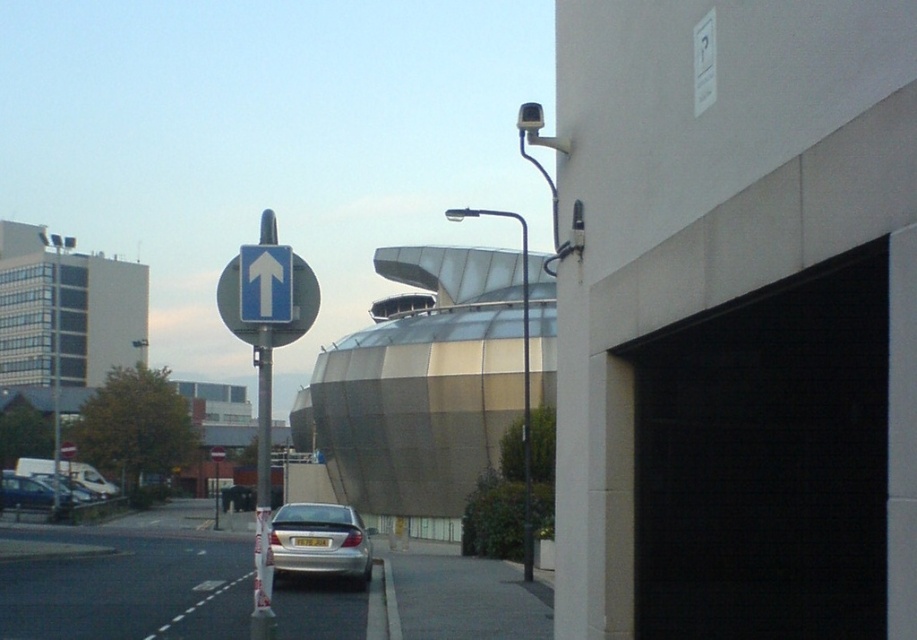
Question: Which object is farther from the camera taking this photo?

Choices:
 (A) metallic silver car at lower left
 (B) smooth asphalt road at lower left
 (C) gray concrete pavement at lower center

Answer: (A)

Question: Does silver metallic car at lower center have a lesser width compared to metallic silver car at lower left?

Choices:
 (A) no
 (B) yes

Answer: (A)

Question: Is blue glossy arrow at upper center in front of metallic silver car at lower left?

Choices:
 (A) no
 (B) yes

Answer: (B)

Question: Which point is closer to the camera?

Choices:
 (A) (6, 492)
 (B) (422, 616)
 (C) (125, 596)

Answer: (B)

Question: Which is farther from the metallic silver car at lower left?

Choices:
 (A) silver metallic car at lower center
 (B) blue glossy arrow at upper center
 (C) gray concrete pavement at lower center
 (D) blue glossy sign at upper left

Answer: (B)

Question: Does silver metallic car at lower center have a larger size compared to blue glossy arrow at upper center?

Choices:
 (A) no
 (B) yes

Answer: (B)